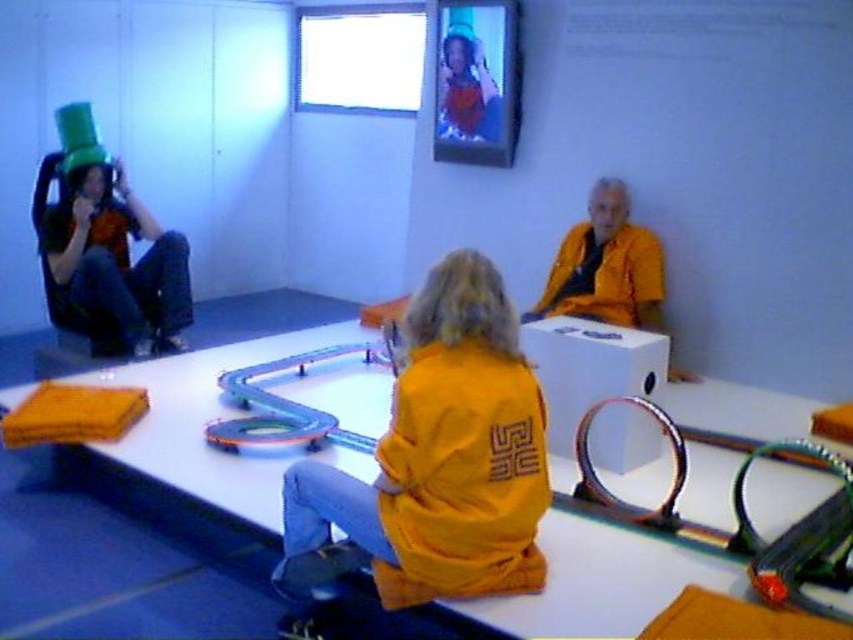
You are standing in the room and want to place a small plant between the yellow matte jacket at center and the matte black robe at left. Based on their positions, where should you place the plant?

The yellow matte jacket at center is below the matte black robe at left, so you should place the plant between them horizontally, positioning it to the right of the matte black robe at left and to the left of the yellow matte jacket at center.

You are a delivery robot in the room. You need to deliver a package to the person wearing the yellow matte jacket at center. The robot has a maximum reach of 2.5 meters. Can you reach them from your current position near the matte green hat at upper left without moving closer?

The yellow matte jacket at center and matte green hat at upper left are 3.01 meters apart. Since the robot can only reach 2.5 meters, it cannot deliver the package without moving closer.